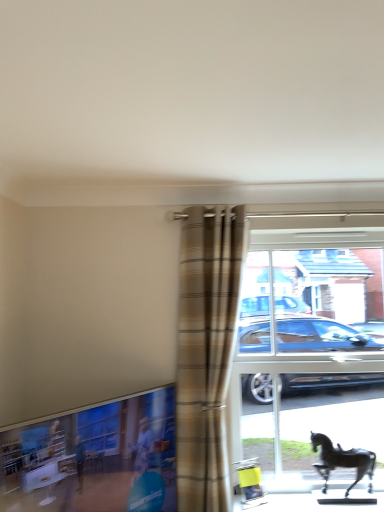
Question: From the image's perspective, is transparent glass horse at right under clear glass window at lower left?

Choices:
 (A) no
 (B) yes

Answer: (A)

Question: Is transparent glass horse at right not within clear glass window at lower left?

Choices:
 (A) yes
 (B) no

Answer: (A)

Question: From the image's perspective, does transparent glass horse at right appear higher than clear glass window at lower left?

Choices:
 (A) no
 (B) yes

Answer: (B)

Question: Does transparent glass horse at right have a lesser width compared to clear glass window at lower left?

Choices:
 (A) yes
 (B) no

Answer: (A)

Question: Does transparent glass horse at right have a greater width compared to clear glass window at lower left?

Choices:
 (A) no
 (B) yes

Answer: (A)

Question: Considering the relative positions of transparent glass horse at right and clear glass window at lower left in the image provided, is transparent glass horse at right in front of clear glass window at lower left?

Choices:
 (A) no
 (B) yes

Answer: (A)

Question: Is clear glass window at lower left at the right side of plaid fabric curtain at center?

Choices:
 (A) yes
 (B) no

Answer: (B)

Question: Is clear glass window at lower left in contact with plaid fabric curtain at center?

Choices:
 (A) no
 (B) yes

Answer: (A)

Question: Is clear glass window at lower left positioned behind plaid fabric curtain at center?

Choices:
 (A) no
 (B) yes

Answer: (A)

Question: Considering the relative sizes of clear glass window at lower left and plaid fabric curtain at center in the image provided, is clear glass window at lower left wider than plaid fabric curtain at center?

Choices:
 (A) yes
 (B) no

Answer: (A)

Question: Does clear glass window at lower left have a lesser width compared to plaid fabric curtain at center?

Choices:
 (A) yes
 (B) no

Answer: (B)

Question: Is clear glass window at lower left not within plaid fabric curtain at center?

Choices:
 (A) yes
 (B) no

Answer: (A)

Question: Are transparent glass horse at right and plaid fabric curtain at center beside each other?

Choices:
 (A) no
 (B) yes

Answer: (A)